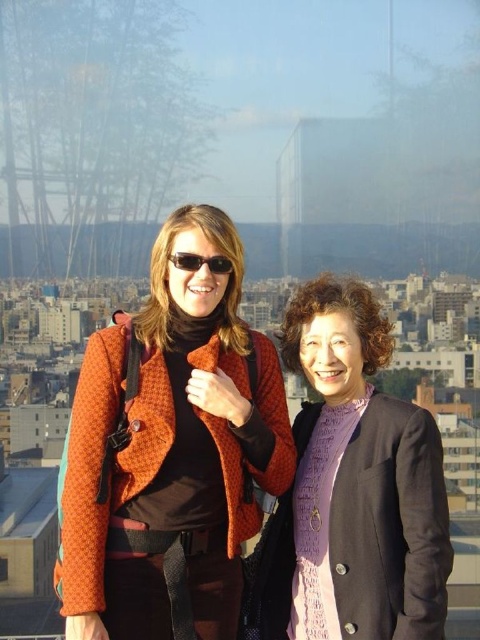
Question: Which is farther from the orange textured jacket at left?

Choices:
 (A) matte black sunglasses at center
 (B) purple knitted scarf at center

Answer: (A)

Question: Can you confirm if orange textured jacket at left is thinner than matte black sunglasses at center?

Choices:
 (A) no
 (B) yes

Answer: (A)

Question: Is the position of orange textured jacket at left more distant than that of matte black sunglasses at center?

Choices:
 (A) yes
 (B) no

Answer: (B)

Question: Does orange textured jacket at left appear over matte black sunglasses at center?

Choices:
 (A) yes
 (B) no

Answer: (B)

Question: Which of the following is the farthest from the observer?

Choices:
 (A) (177, 403)
 (B) (225, 260)

Answer: (B)

Question: Estimate the real-world distances between objects in this image. Which object is closer to the orange textured jacket at left?

Choices:
 (A) matte black sunglasses at center
 (B) purple knitted scarf at center

Answer: (B)